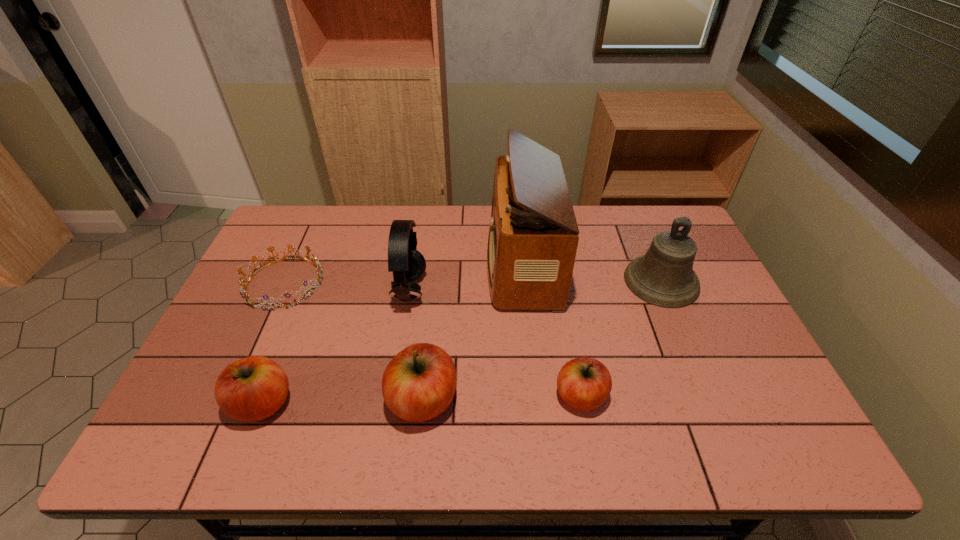
At what (x,y) coordinates should I click in order to perform the action: click on empty space that is in between the second shortest object and the radio receiver. Please return your answer as a coordinate pair (x, y). The height and width of the screenshot is (540, 960). Looking at the image, I should click on click(551, 330).

Locate an element on the screen. This screenshot has height=540, width=960. free space between the tiara and the fifth tallest object is located at coordinates (274, 343).

Where is `vacant space that's between the shortest object and the bell`? vacant space that's between the shortest object and the bell is located at coordinates (473, 282).

You are a GUI agent. You are given a task and a screenshot of the screen. Output one action in this format:
    pyautogui.click(x=<x>, y=<y>)
    Task: Click on the sixth closest object relative to the second tallest apple
    Image resolution: width=960 pixels, height=540 pixels.
    Given the screenshot: What is the action you would take?
    pyautogui.click(x=664, y=276)

Select which object is the closest to the rightmost object. Please provide its 2D coordinates. Your answer should be formatted as a tuple, i.e. [(x, y)], where the tuple contains the x and y coordinates of a point satisfying the conditions above.

[(533, 237)]

Where is `apple that stands as the second closest to the shortest apple`? apple that stands as the second closest to the shortest apple is located at coordinates (253, 388).

Select which apple is the closest to the second apple from right to left. Please provide its 2D coordinates. Your answer should be formatted as a tuple, i.e. [(x, y)], where the tuple contains the x and y coordinates of a point satisfying the conditions above.

[(253, 388)]

The height and width of the screenshot is (540, 960). Find the location of `free space that satisfies the following two spatial constraints: 1. on the back side of the leftmost apple; 2. on the front-facing side of the shortest object`. free space that satisfies the following two spatial constraints: 1. on the back side of the leftmost apple; 2. on the front-facing side of the shortest object is located at coordinates (310, 283).

Where is `vacant space that satisfies the following two spatial constraints: 1. on the front panel of the rightmost apple; 2. on the right side of the radio receiver`? This screenshot has height=540, width=960. vacant space that satisfies the following two spatial constraints: 1. on the front panel of the rightmost apple; 2. on the right side of the radio receiver is located at coordinates (536, 396).

Identify the location of vacant space that satisfies the following two spatial constraints: 1. on the front-facing side of the shortest object; 2. on the right side of the second apple from right to left. (231, 400).